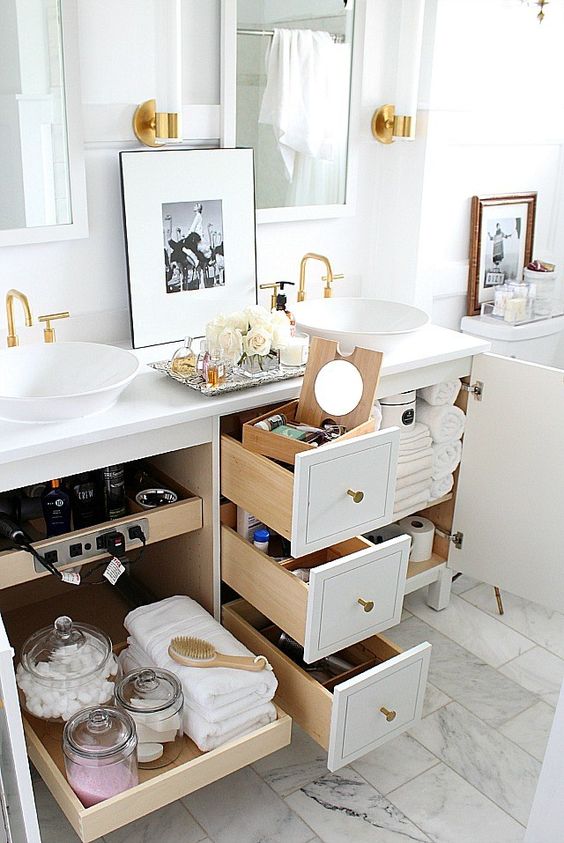
Find the location of `knob`. knob is located at coordinates (387, 715), (367, 604), (355, 495).